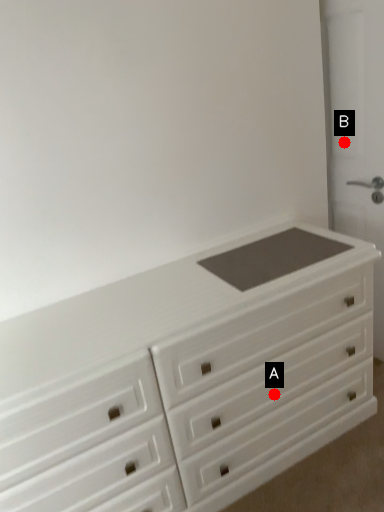
Question: Two points are circled on the image, labeled by A and B beside each circle. Among these points, which one is farthest from the camera?

Choices:
 (A) A is further
 (B) B is further

Answer: (B)